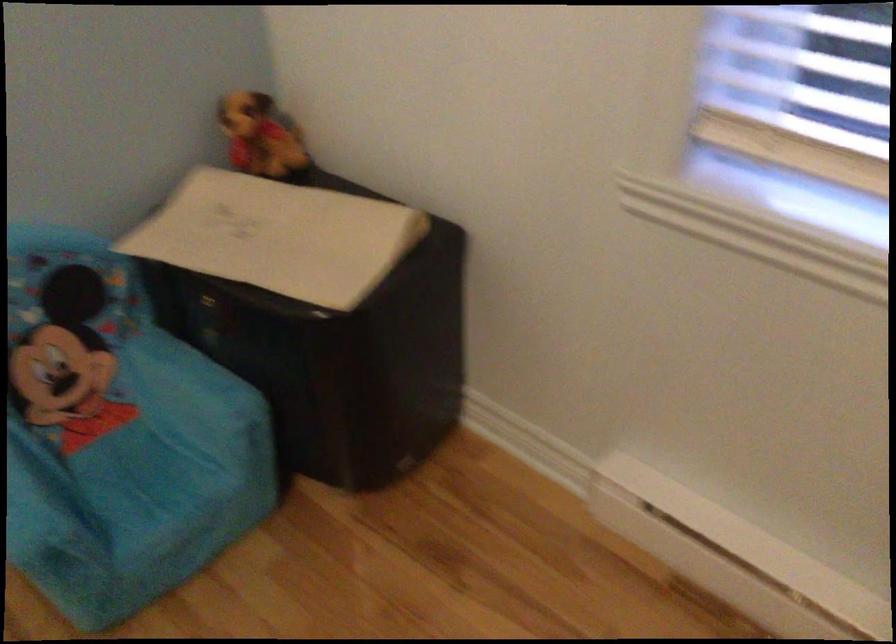
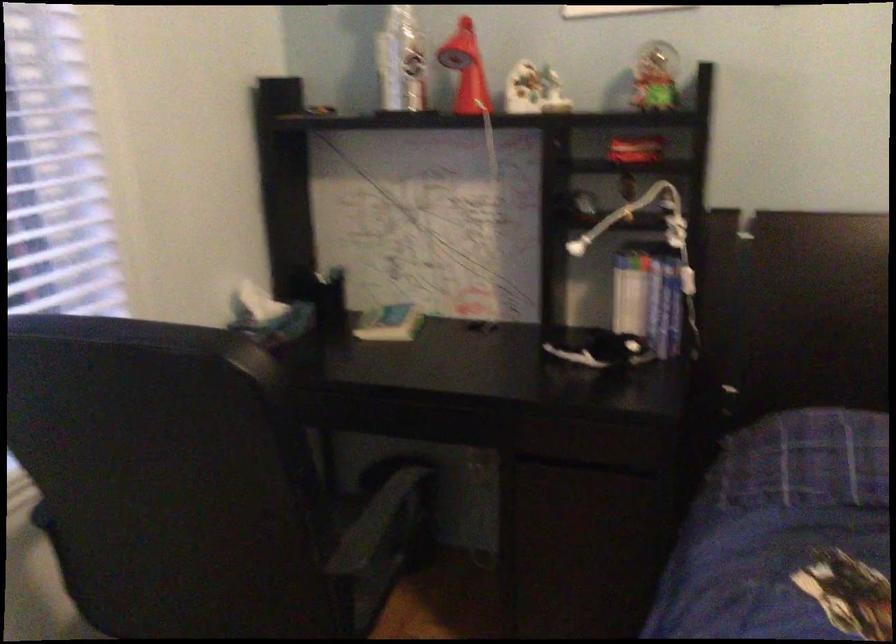
In the scene shown: First-person continuous shooting, in which direction is the camera rotating?

The camera's rotation is toward right-down.